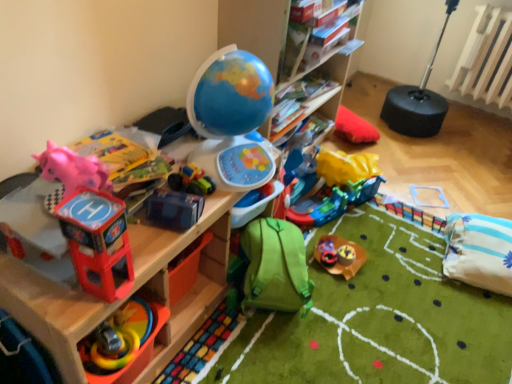
Question: From the image's perspective, does shiny metallic toy car at center, the 9th toy in the left-to-right sequence, appear higher than white striped pillow at lower right?

Choices:
 (A) no
 (B) yes

Answer: (A)

Question: Is shiny metallic toy car at center, which ranks as the 1th toy in right-to-left order, next to white striped pillow at lower right?

Choices:
 (A) no
 (B) yes

Answer: (A)

Question: Is shiny metallic toy car at center, which ranks as the 1th toy in right-to-left order, oriented away from white striped pillow at lower right?

Choices:
 (A) yes
 (B) no

Answer: (B)

Question: Is the depth of shiny metallic toy car at center, the 9th toy in the left-to-right sequence, greater than that of white striped pillow at lower right?

Choices:
 (A) yes
 (B) no

Answer: (A)

Question: Does shiny metallic toy car at center, which ranks as the 1th toy in right-to-left order, have a smaller size compared to white striped pillow at lower right?

Choices:
 (A) no
 (B) yes

Answer: (B)

Question: Is shiny metallic toy car at center, which ranks as the 1th toy in right-to-left order, positioned before white striped pillow at lower right?

Choices:
 (A) yes
 (B) no

Answer: (B)

Question: Is white striped pillow at lower right at the left side of blue plastic toy at center, which ranks as the sixth toy in right-to-left order?

Choices:
 (A) yes
 (B) no

Answer: (B)

Question: Considering the relative positions of white striped pillow at lower right and blue plastic toy at center, the 4th toy viewed from the left, in the image provided, is white striped pillow at lower right to the right of blue plastic toy at center, the 4th toy viewed from the left, from the viewer's perspective?

Choices:
 (A) yes
 (B) no

Answer: (A)

Question: Are white striped pillow at lower right and blue plastic toy at center, the 4th toy viewed from the left, far apart?

Choices:
 (A) no
 (B) yes

Answer: (B)

Question: From a real-world perspective, is white striped pillow at lower right over blue plastic toy at center, the 4th toy viewed from the left?

Choices:
 (A) yes
 (B) no

Answer: (B)

Question: From a real-world perspective, is white striped pillow at lower right under blue plastic toy at center, which ranks as the sixth toy in right-to-left order?

Choices:
 (A) yes
 (B) no

Answer: (A)

Question: Is white striped pillow at lower right placed right next to blue plastic toy at center, which ranks as the sixth toy in right-to-left order?

Choices:
 (A) no
 (B) yes

Answer: (A)

Question: From the image's perspective, is pink rubber duck at left, which appears as the 9th toy when viewed from the right, below green fabric backpack at lower center, which is the sixth toy in left-to-right order?

Choices:
 (A) no
 (B) yes

Answer: (A)